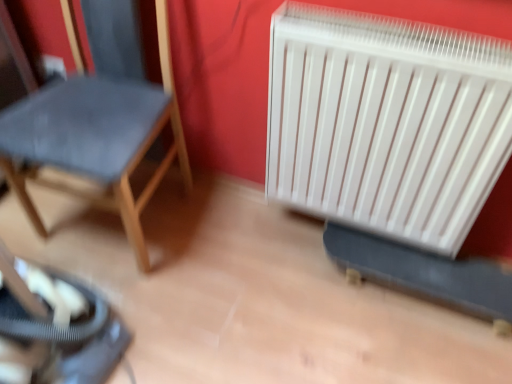
Question: From a real-world perspective, is white plastic radiator at right positioned above or below velvet blue chair at left?

Choices:
 (A) above
 (B) below

Answer: (B)

Question: In terms of width, does white plastic radiator at right look wider or thinner when compared to velvet blue chair at left?

Choices:
 (A) thin
 (B) wide

Answer: (A)

Question: Would you say white plastic radiator at right is to the left or to the right of velvet blue chair at left in the picture?

Choices:
 (A) left
 (B) right

Answer: (B)

Question: Considering their positions, is velvet blue chair at left located in front of or behind white plastic radiator at right?

Choices:
 (A) behind
 (B) front

Answer: (B)

Question: Based on their positions, is velvet blue chair at left located to the left or right of white plastic radiator at right?

Choices:
 (A) right
 (B) left

Answer: (B)

Question: Considering the positions of point coord(76,99) and point coord(417,225), is point coord(76,99) closer or farther from the camera than point coord(417,225)?

Choices:
 (A) closer
 (B) farther

Answer: (A)

Question: From a real-world perspective, is velvet blue chair at left positioned above or below white plastic radiator at right?

Choices:
 (A) below
 (B) above

Answer: (B)